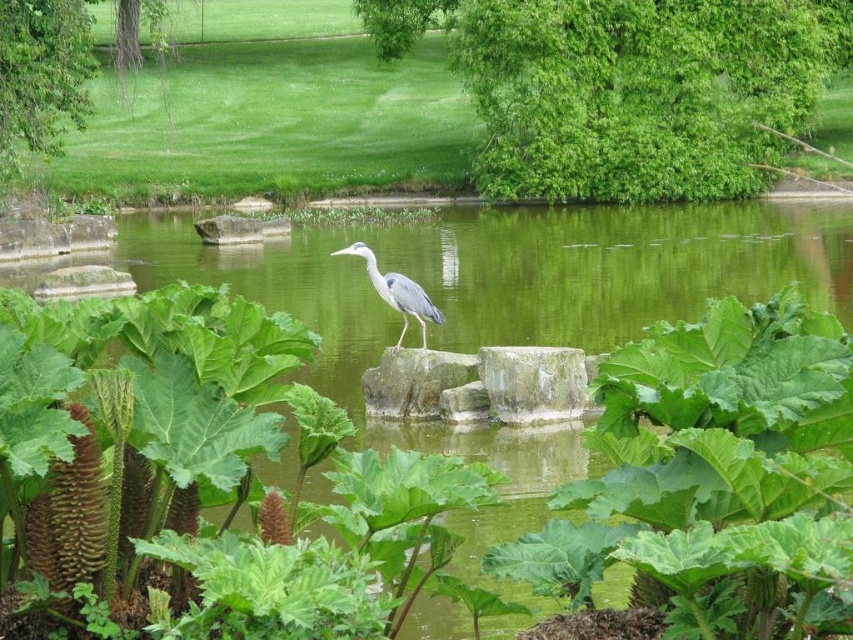
Question: Does green leafy tree at upper center lie behind gray matte bird at center?

Choices:
 (A) yes
 (B) no

Answer: (A)

Question: Which point is closer to the camera taking this photo?

Choices:
 (A) (360, 248)
 (B) (640, 150)

Answer: (A)

Question: Which of the following is the farthest from the observer?

Choices:
 (A) (351, 243)
 (B) (635, 196)

Answer: (B)

Question: Is green leafy tree at upper center smaller than gray matte bird at center?

Choices:
 (A) no
 (B) yes

Answer: (A)

Question: Which point is farther to the camera?

Choices:
 (A) (412, 289)
 (B) (717, 163)

Answer: (B)

Question: Is green leafy tree at upper center wider than gray matte bird at center?

Choices:
 (A) no
 (B) yes

Answer: (B)